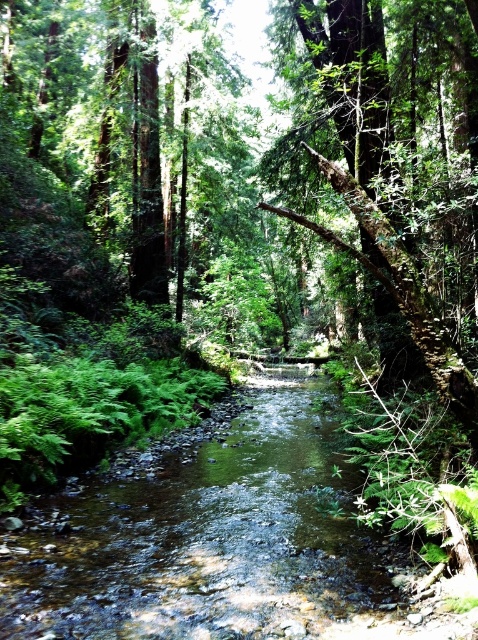
Does clear water stream at center appear on the left side of mossy bark tree at center?

Indeed, clear water stream at center is positioned on the left side of mossy bark tree at center.

Which is behind, point (328, 577) or point (416, 320)?

Point (328, 577)

Measure the distance between clear water stream at center and camera.

8.04 feet

Identify the location of clear water stream at center. (208, 541).